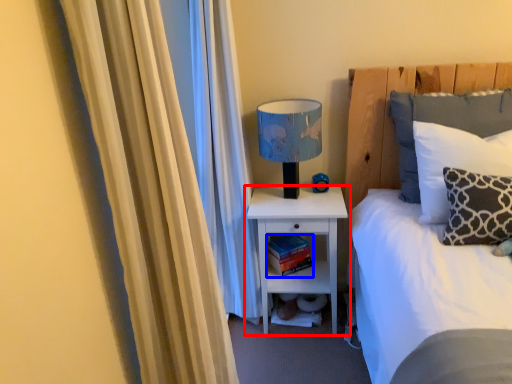
Question: Which of the following is the closest to the observer, nightstand (highlighted by a red box) or book (highlighted by a blue box)?

Choices:
 (A) nightstand
 (B) book

Answer: (A)